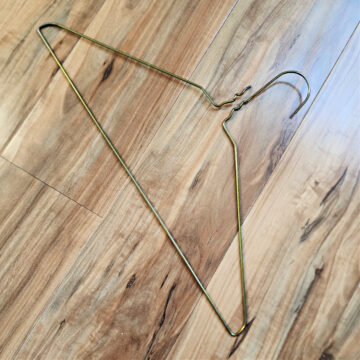
Where is `top of hook on hanger`? Image resolution: width=360 pixels, height=360 pixels. top of hook on hanger is located at coordinates [x=302, y=76].